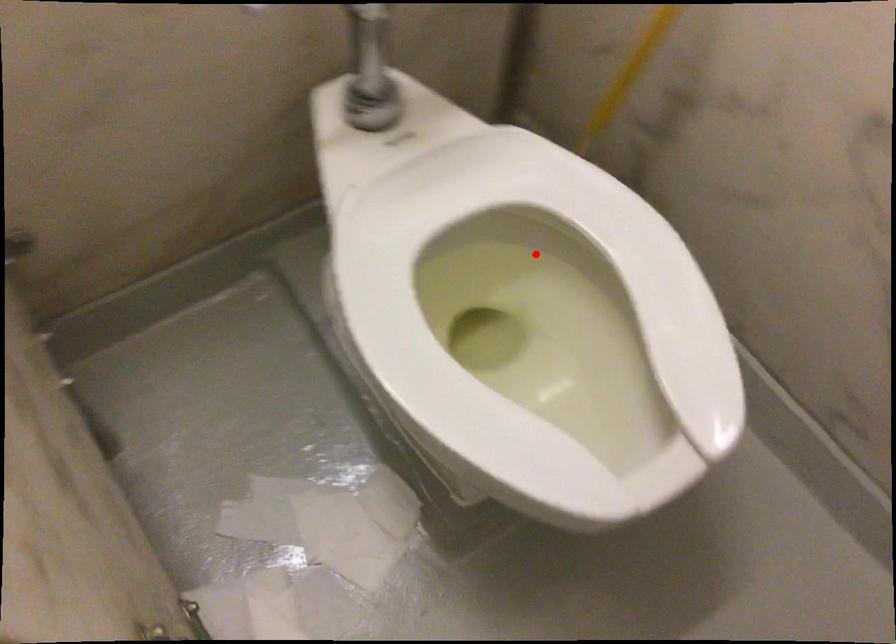
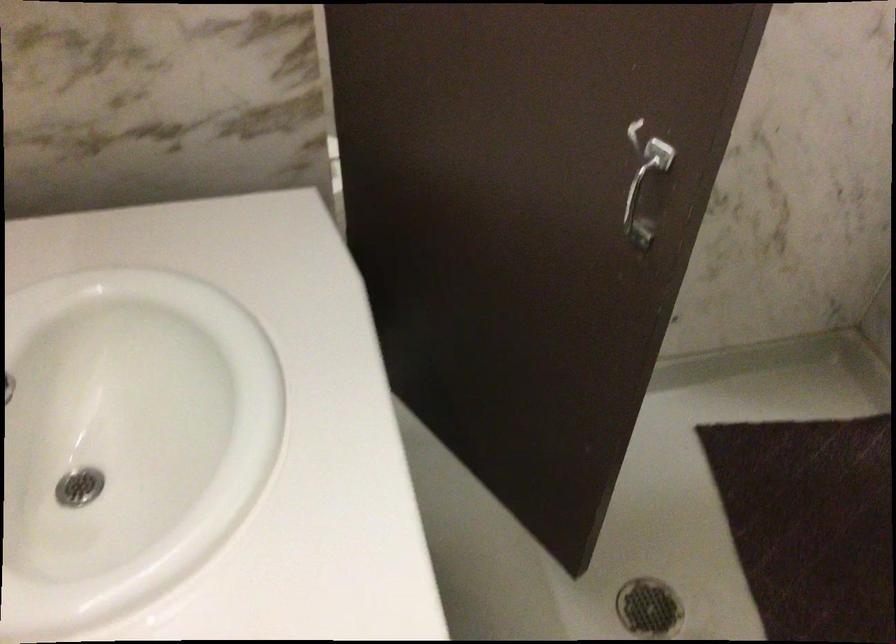
Question: I am providing you with two images of the same scene from different viewpoints. A red point is marked on the first image. Can you still see the location of the red point in image 2?

Choices:
 (A) Yes
 (B) No

Answer: (B)